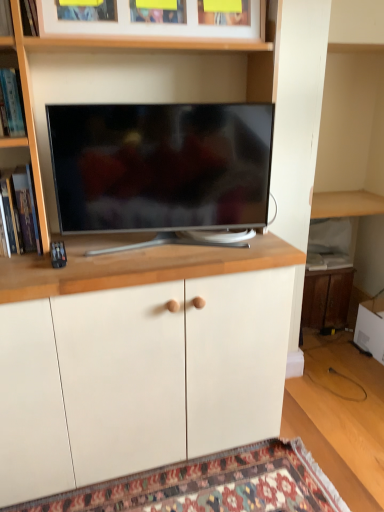
Question: From a real-world perspective, does wooden shelf at upper left, which ranks as the second shelf in bottom-to-top order, stand above wooden picture frame at upper center?

Choices:
 (A) no
 (B) yes

Answer: (A)

Question: Is wooden shelf at upper left, which ranks as the second shelf in bottom-to-top order, closer to camera compared to wooden picture frame at upper center?

Choices:
 (A) no
 (B) yes

Answer: (B)

Question: Does wooden shelf at upper left, marked as the 2th shelf in a top-to-bottom arrangement, contain wooden picture frame at upper center?

Choices:
 (A) yes
 (B) no

Answer: (B)

Question: Does wooden shelf at upper left, marked as the 2th shelf in a top-to-bottom arrangement, have a lesser height compared to wooden picture frame at upper center?

Choices:
 (A) no
 (B) yes

Answer: (A)

Question: Does wooden shelf at upper left, marked as the 2th shelf in a top-to-bottom arrangement, have a lesser width compared to wooden picture frame at upper center?

Choices:
 (A) no
 (B) yes

Answer: (A)

Question: Is wooden shelf at upper left, marked as the 2th shelf in a top-to-bottom arrangement, oriented towards wooden picture frame at upper center?

Choices:
 (A) yes
 (B) no

Answer: (B)

Question: Considering the relative sizes of carpeted mat at lower center and wooden cabinet at lower right, arranged as the 1th cabinetry when viewed from the right, in the image provided, is carpeted mat at lower center shorter than wooden cabinet at lower right, arranged as the 1th cabinetry when viewed from the right,?

Choices:
 (A) yes
 (B) no

Answer: (A)

Question: Is carpeted mat at lower center turned away from wooden cabinet at lower right, which ranks as the first cabinetry in back-to-front order?

Choices:
 (A) no
 (B) yes

Answer: (A)

Question: Is the surface of carpeted mat at lower center in direct contact with wooden cabinet at lower right, which ranks as the 2th cabinetry in left-to-right order?

Choices:
 (A) no
 (B) yes

Answer: (A)

Question: From the image's perspective, is carpeted mat at lower center above wooden cabinet at lower right, arranged as the 1th cabinetry when viewed from the right?

Choices:
 (A) no
 (B) yes

Answer: (A)

Question: Could you tell me if carpeted mat at lower center is facing wooden cabinet at lower right, which ranks as the 2th cabinetry in left-to-right order?

Choices:
 (A) no
 (B) yes

Answer: (A)

Question: Is carpeted mat at lower center completely or partially outside of wooden cabinet at lower right, arranged as the 1th cabinetry when viewed from the right?

Choices:
 (A) yes
 (B) no

Answer: (A)

Question: Can you confirm if carpeted mat at lower center is taller than wooden picture frame at upper center?

Choices:
 (A) yes
 (B) no

Answer: (B)